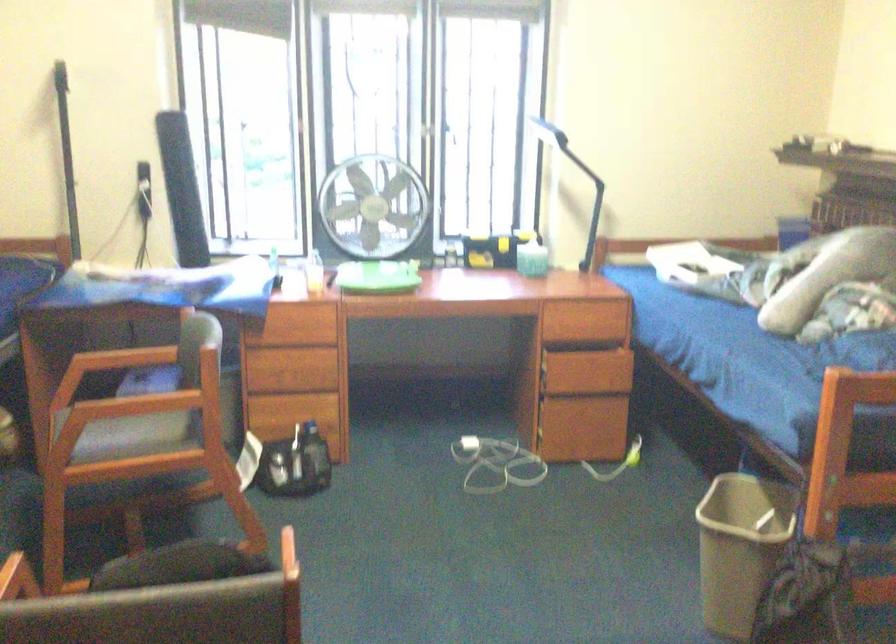
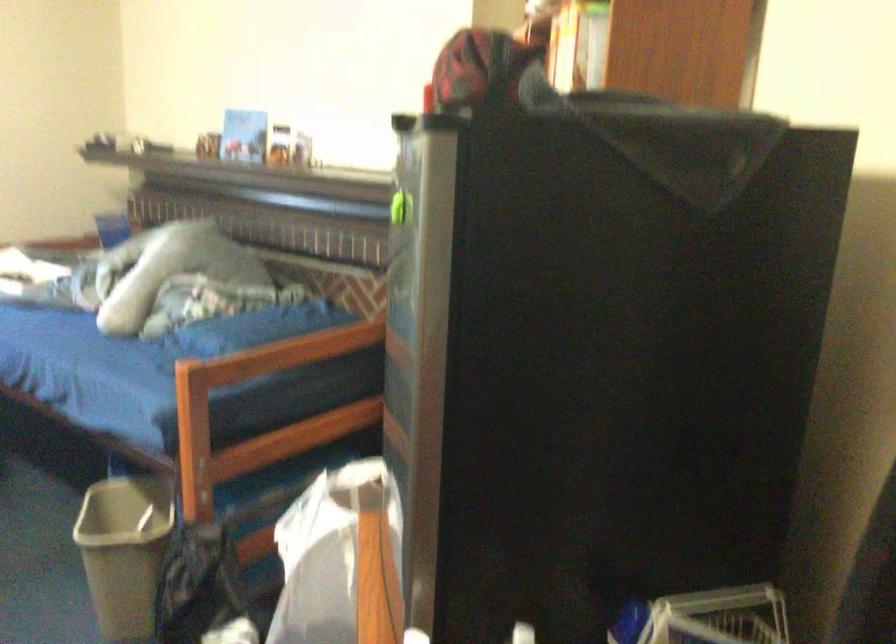
Question: How did the camera likely rotate?

Choices:
 (A) Left
 (B) Right
 (C) Up
 (D) Down

Answer: (B)